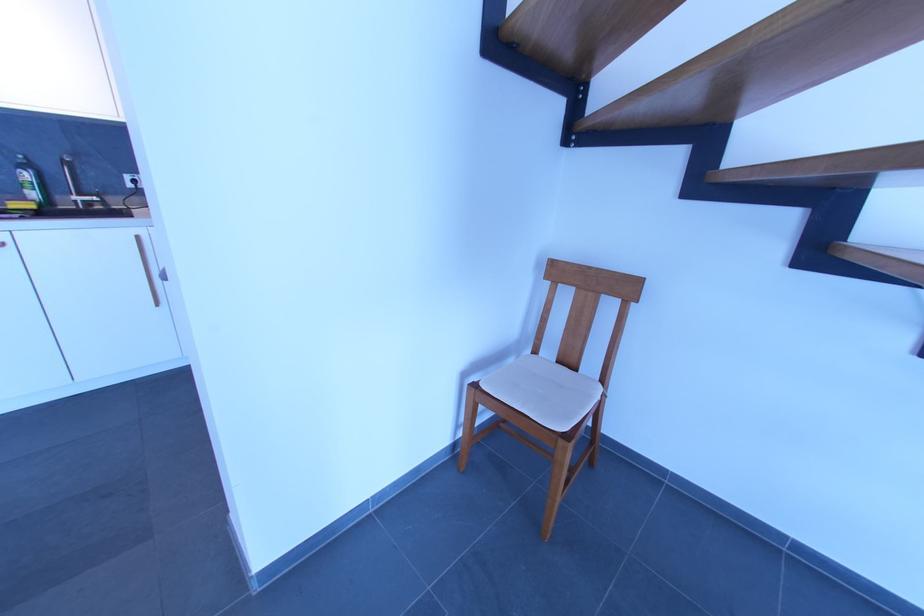
Where would you pull the wooden cabinet handle? Please return your answer as a coordinate pair (x, y).

(150, 270)